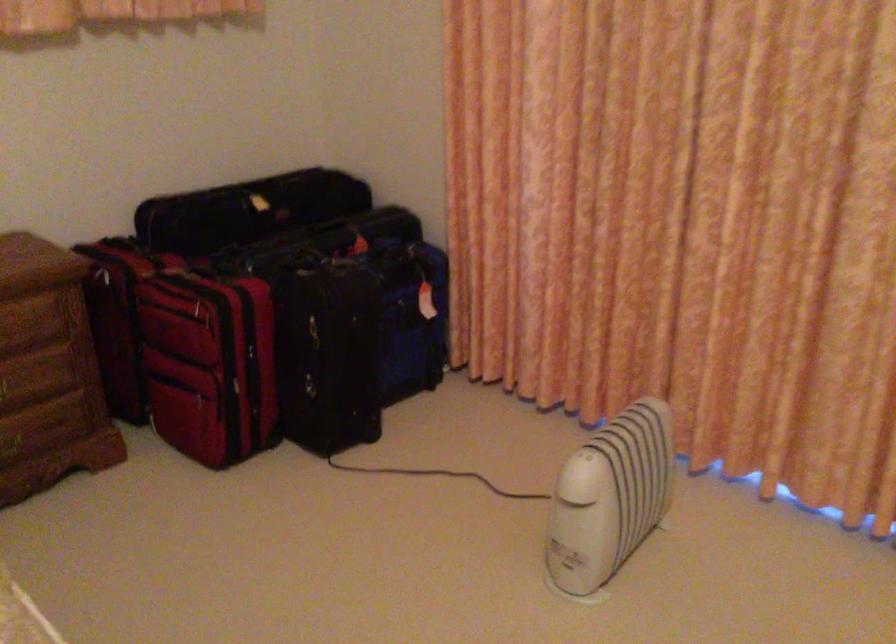
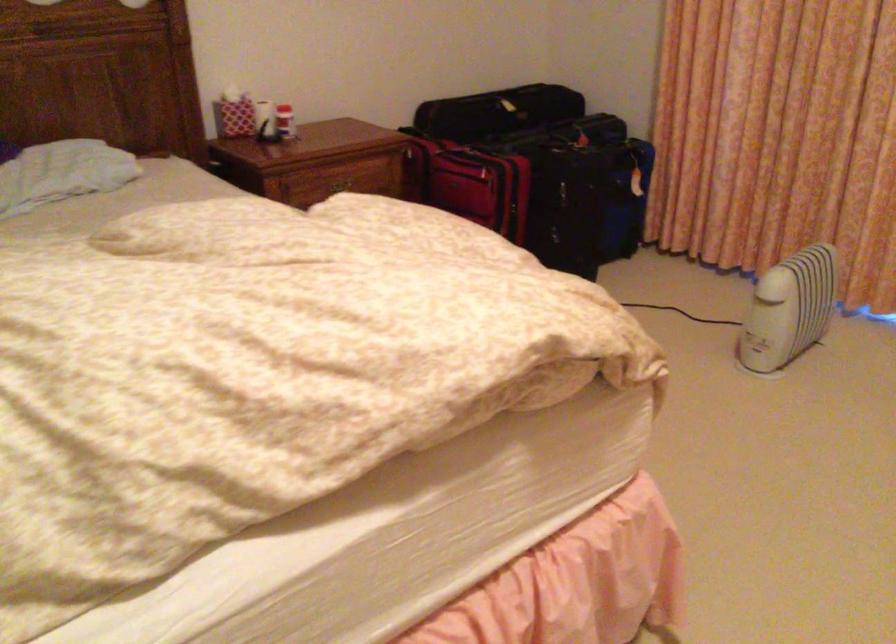
Where in the second image is the point corresponding to point 194,319 from the first image?

(469, 183)